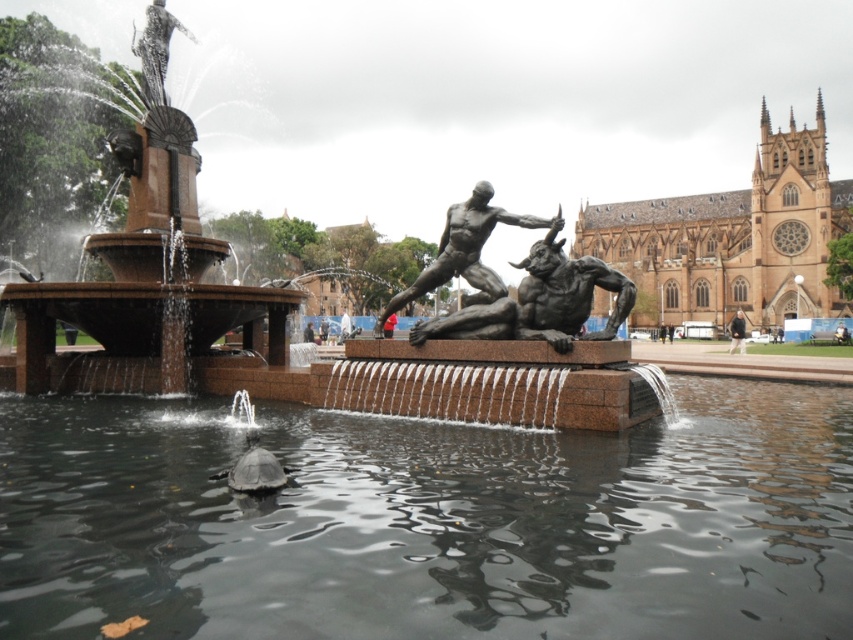
Can you confirm if dark gray water at center is bigger than bronze/metallic figure at center?

Yes, dark gray water at center is bigger than bronze/metallic figure at center.

Can you confirm if dark gray water at center is wider than bronze/metallic figure at center?

Correct, the width of dark gray water at center exceeds that of bronze/metallic figure at center.

Identify the location of dark gray water at center. Image resolution: width=853 pixels, height=640 pixels. (430, 522).

Locate an element on the screen. The width and height of the screenshot is (853, 640). dark gray water at center is located at coordinates (430, 522).

Which is in front, point (245, 452) or point (734, 346)?

Point (245, 452) is in front.

Does point (256, 490) come in front of point (734, 321)?

Yes, it is in front of point (734, 321).

Image resolution: width=853 pixels, height=640 pixels. I want to click on shiny black turtle at lower center, so click(254, 468).

Where is `shiny black turtle at lower center`? The height and width of the screenshot is (640, 853). shiny black turtle at lower center is located at coordinates (254, 468).

Who is positioned more to the left, polished silver statue at upper left or shiny black turtle at lower center?

polished silver statue at upper left

Does polished silver statue at upper left appear under shiny black turtle at lower center?

Actually, polished silver statue at upper left is above shiny black turtle at lower center.

Who is more forward, (177, 22) or (254, 452)?

Point (254, 452)

What are the coordinates of `polished silver statue at upper left` in the screenshot? It's located at (155, 51).